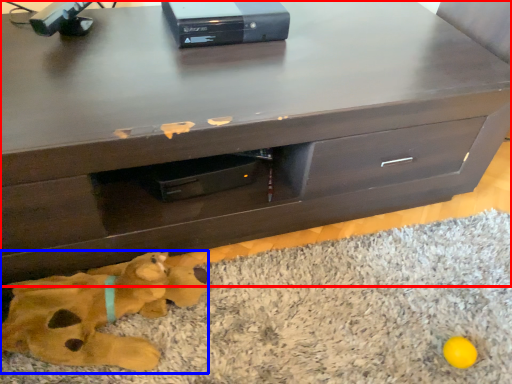
Question: Which point is closer to the camera, chest of drawers (highlighted by a red box) or animal (highlighted by a blue box)?

Choices:
 (A) chest of drawers
 (B) animal

Answer: (A)